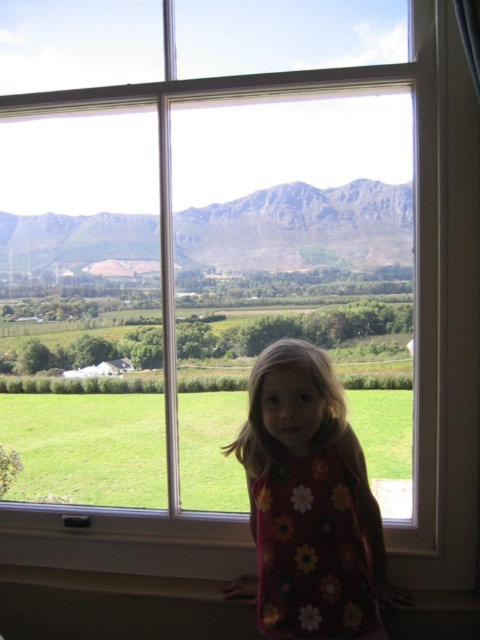
Question: Does floral fabric dress at center appear over rocky gray mountain at center?

Choices:
 (A) yes
 (B) no

Answer: (B)

Question: Which object is farther from the camera taking this photo?

Choices:
 (A) floral fabric dress at center
 (B) rocky gray mountain at center

Answer: (B)

Question: Which point is farther to the camera?

Choices:
 (A) (372, 544)
 (B) (19, 234)

Answer: (B)

Question: Does floral fabric dress at center appear over rocky gray mountain at center?

Choices:
 (A) no
 (B) yes

Answer: (A)

Question: Is floral fabric dress at center below rocky gray mountain at center?

Choices:
 (A) no
 (B) yes

Answer: (B)